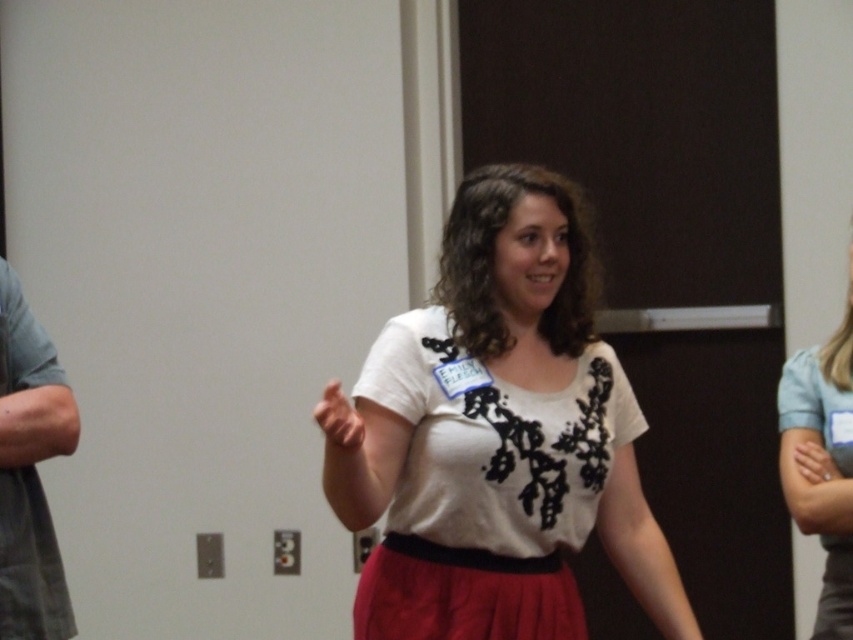
The width and height of the screenshot is (853, 640). What do you see at coordinates (503, 404) in the screenshot?
I see `white matte shirt at center` at bounding box center [503, 404].

Which is above, white matte shirt at center or matte white blouse at center?

white matte shirt at center is higher up.

Describe the element at coordinates (503, 404) in the screenshot. The height and width of the screenshot is (640, 853). I see `white matte shirt at center` at that location.

This screenshot has width=853, height=640. Identify the location of white matte shirt at center. (503, 404).

Can you confirm if white matte shirt at center is positioned to the right of gray fabric shirt at left?

Indeed, white matte shirt at center is positioned on the right side of gray fabric shirt at left.

Does white matte shirt at center have a greater width compared to gray fabric shirt at left?

Indeed, white matte shirt at center has a greater width compared to gray fabric shirt at left.

Find the location of a particular element. white matte shirt at center is located at coordinates (503, 404).

Which is in front, point (22, 561) or point (816, 428)?

Point (22, 561) is in front.

Is point (0, 456) positioned after point (831, 528)?

No, it is not.

Is point (28, 385) less distant than point (813, 412)?

Yes, it is in front of point (813, 412).

Locate an element on the screen. gray fabric shirt at left is located at coordinates [x=30, y=472].